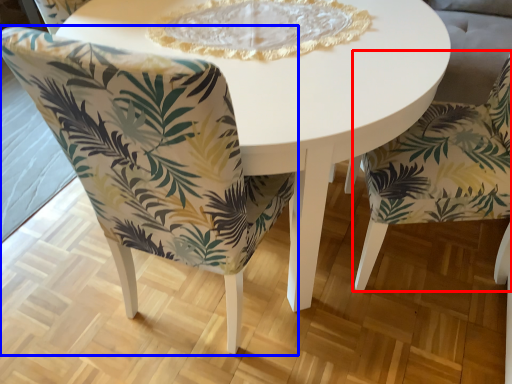
Question: Which object is closer to the camera taking this photo, chair (highlighted by a red box) or chair (highlighted by a blue box)?

Choices:
 (A) chair
 (B) chair

Answer: (B)